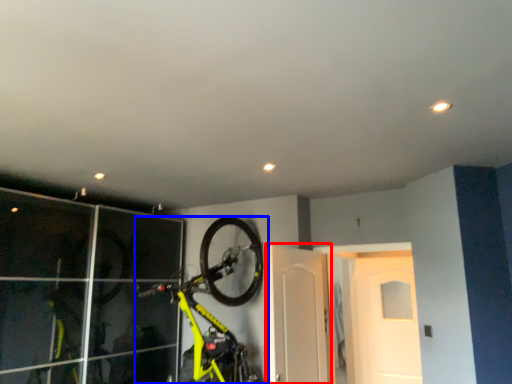
Question: Which point is further to the camera, door (highlighted by a red box) or bicycle (highlighted by a blue box)?

Choices:
 (A) door
 (B) bicycle

Answer: (A)